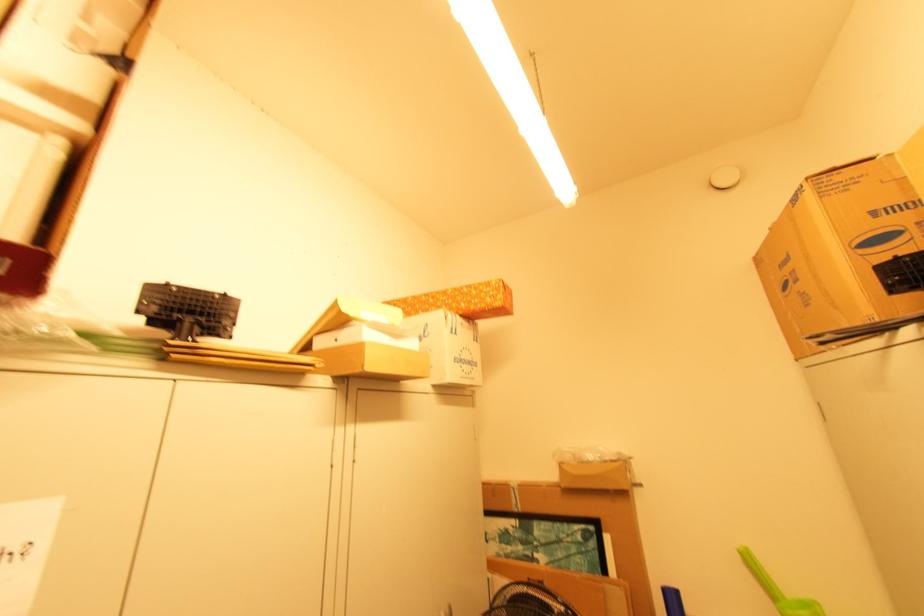
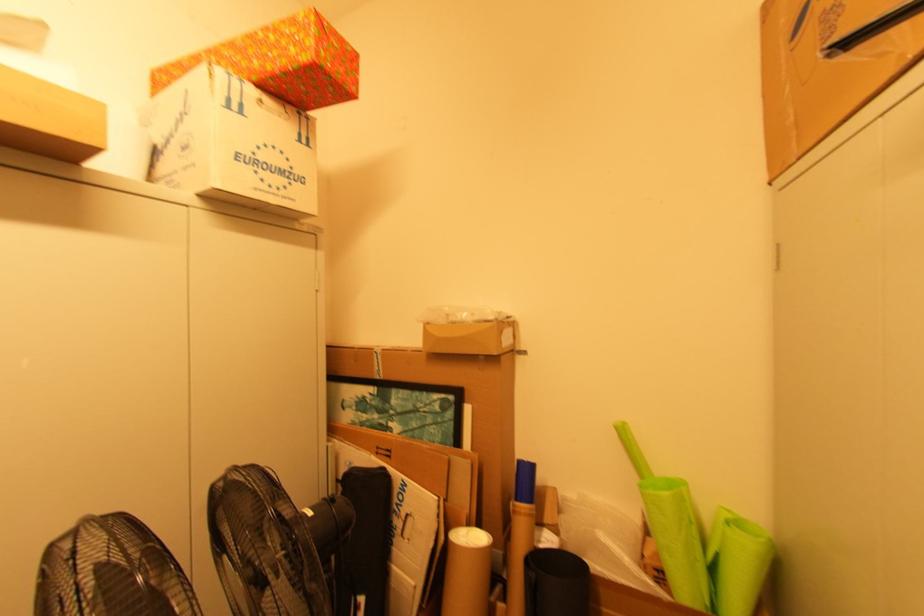
Find the pixel in the second image that matches (x=463, y=355) in the first image.

(257, 154)